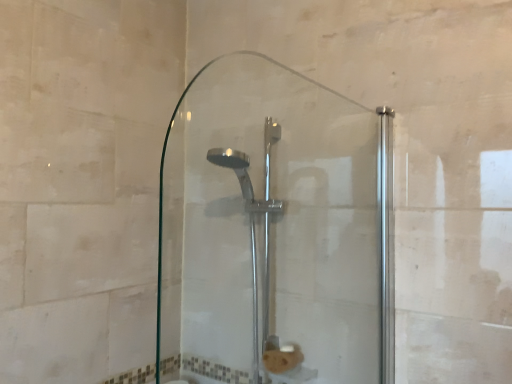
What is the approximate height of clear glass shower door at center?

clear glass shower door at center is 26.75 inches tall.

From the picture: Measure the distance between clear glass shower door at center and camera.

clear glass shower door at center and camera are 3.41 feet apart.

Find the location of a particular element. clear glass shower door at center is located at coordinates (274, 232).

The image size is (512, 384). What do you see at coordinates (274, 232) in the screenshot?
I see `clear glass shower door at center` at bounding box center [274, 232].

I want to click on polished chrome shower head at center, so click(252, 230).

Describe the element at coordinates (252, 230) in the screenshot. This screenshot has width=512, height=384. I see `polished chrome shower head at center` at that location.

You are a GUI agent. You are given a task and a screenshot of the screen. Output one action in this format:
    pyautogui.click(x=<x>, y=<y>)
    Task: Click on the clear glass shower door at center
    
    Given the screenshot: What is the action you would take?
    pyautogui.click(x=274, y=232)

Which object is positioned more to the left, clear glass shower door at center or polished chrome shower head at center?

Positioned to the left is polished chrome shower head at center.

Between clear glass shower door at center and polished chrome shower head at center, which one is positioned in front?

clear glass shower door at center is more forward.

Is point (252, 377) more distant than point (237, 170)?

No, it is not.

From the image's perspective, is clear glass shower door at center located above or below polished chrome shower head at center?

Based on their image positions, clear glass shower door at center is located above polished chrome shower head at center.

From a real-world perspective, is clear glass shower door at center above or below polished chrome shower head at center?

clear glass shower door at center is above polished chrome shower head at center.

Does clear glass shower door at center have a lesser width compared to polished chrome shower head at center?

Yes, clear glass shower door at center is thinner than polished chrome shower head at center.

Who is shorter, clear glass shower door at center or polished chrome shower head at center?

Standing shorter between the two is clear glass shower door at center.

Considering the sizes of objects clear glass shower door at center and polished chrome shower head at center in the image provided, who is bigger, clear glass shower door at center or polished chrome shower head at center?

polished chrome shower head at center is bigger.

Could polished chrome shower head at center be considered to be inside clear glass shower door at center?

That's incorrect, polished chrome shower head at center is not inside clear glass shower door at center.

Are clear glass shower door at center and polished chrome shower head at center making contact?

No, clear glass shower door at center is not next to polished chrome shower head at center.

Could you tell me if clear glass shower door at center is facing polished chrome shower head at center?

Yes, clear glass shower door at center is aimed at polished chrome shower head at center.

How different are the orientations of clear glass shower door at center and polished chrome shower head at center in degrees?

The facing directions of clear glass shower door at center and polished chrome shower head at center are 89.9 degrees apart.

Where is `shower below the clear glass shower door at center (from the image's perspective)`? The height and width of the screenshot is (384, 512). shower below the clear glass shower door at center (from the image's perspective) is located at coordinates (252, 230).

Which object is positioned more to the left, polished chrome shower head at center or clear glass shower door at center?

Positioned to the left is polished chrome shower head at center.

Consider the image. Is polished chrome shower head at center positioned in front of clear glass shower door at center?

No, polished chrome shower head at center is behind clear glass shower door at center.

Does point (266, 257) come closer to viewer compared to point (247, 197)?

Yes, it is.

From the image's perspective, is polished chrome shower head at center on top of clear glass shower door at center?

No, from the image's perspective, polished chrome shower head at center is not over clear glass shower door at center.

From a real-world perspective, between polished chrome shower head at center and clear glass shower door at center, who is vertically lower?

polished chrome shower head at center.

Considering the relative sizes of polished chrome shower head at center and clear glass shower door at center in the image provided, is polished chrome shower head at center wider than clear glass shower door at center?

Indeed, polished chrome shower head at center has a greater width compared to clear glass shower door at center.

Is polished chrome shower head at center shorter than clear glass shower door at center?

In fact, polished chrome shower head at center may be taller than clear glass shower door at center.

Based on their sizes in the image, would you say polished chrome shower head at center is bigger or smaller than clear glass shower door at center?

In the image, polished chrome shower head at center appears to be larger than clear glass shower door at center.

Is polished chrome shower head at center not within clear glass shower door at center?

That's correct, polished chrome shower head at center is outside of clear glass shower door at center.

Is polished chrome shower head at center placed right next to clear glass shower door at center?

No, polished chrome shower head at center is not in contact with clear glass shower door at center.

Is polished chrome shower head at center oriented towards clear glass shower door at center?

No, polished chrome shower head at center is not oriented towards clear glass shower door at center.

Can you tell me how much polished chrome shower head at center and clear glass shower door at center differ in facing direction?

There is a 89.9-degree angle between the facing directions of polished chrome shower head at center and clear glass shower door at center.

The image size is (512, 384). What are the coordinates of `screen door positioned vertically above the polished chrome shower head at center (from a real-world perspective)` in the screenshot? It's located at (274, 232).

This screenshot has height=384, width=512. I want to click on shower behind the clear glass shower door at center, so click(252, 230).

Identify the location of shower below the clear glass shower door at center (from the image's perspective). The height and width of the screenshot is (384, 512). (252, 230).